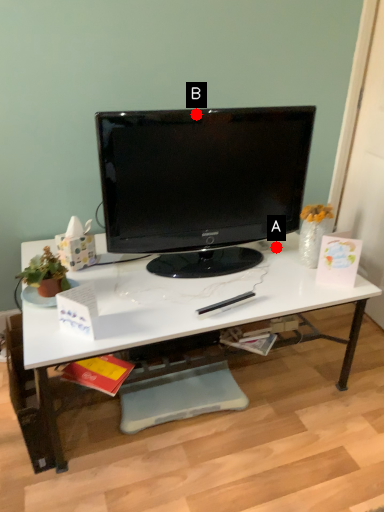
Question: Two points are circled on the image, labeled by A and B beside each circle. Which point appears farthest from the camera in this image?

Choices:
 (A) A is further
 (B) B is further

Answer: (A)